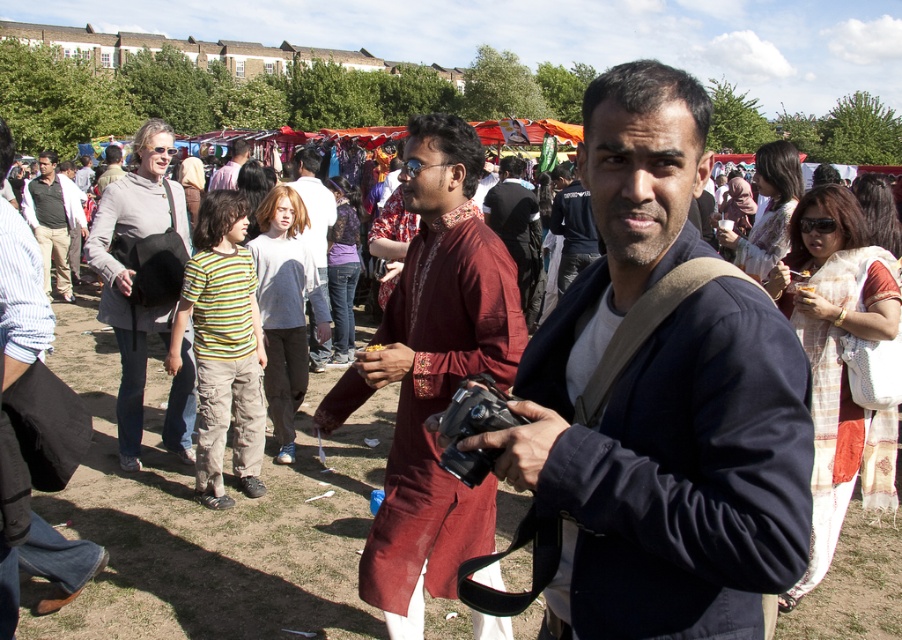
You are a photographer at the event and want to take a photo of both the dark blue jacket at center and the maroon fabric kurta at center. Which clothing item has a narrower width so that you can frame them properly?

The dark blue jacket at center is thinner than the maroon fabric kurta at center, so the dark blue jacket at center has a narrower width and can be framed properly.

What is the location of the point with coordinates (474, 426) in the image?

The point with coordinates (474, 426) is located on the black plastic camera at center.

You are standing in the park and want to take a photo with your black plastic camera at center. To do so, you need to move your matte black jacket at left out of the way. Is the camera closer to you than the jacket?

Yes, the black plastic camera at center is closer to the viewer than the matte black jacket at left, so you can move the jacket without disturbing the camera.